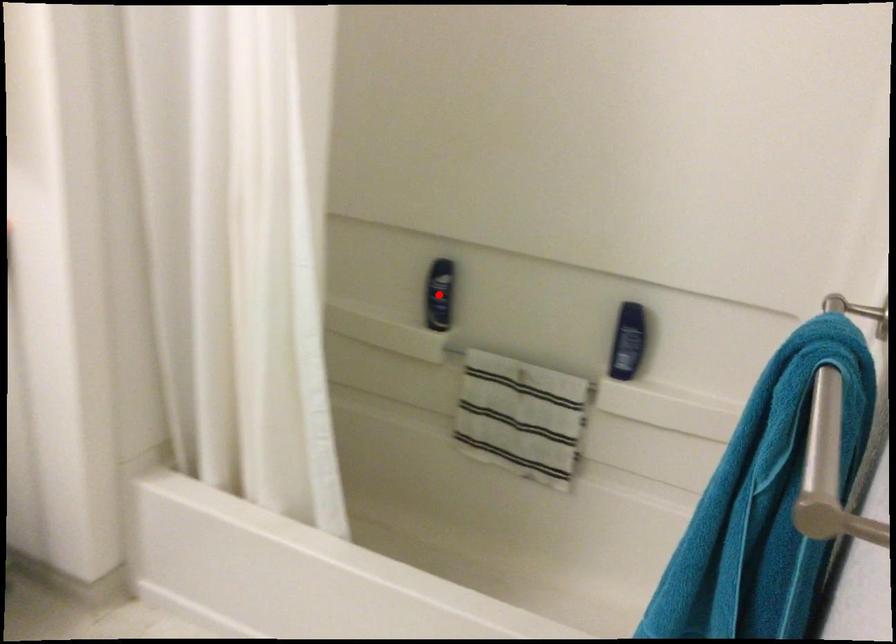
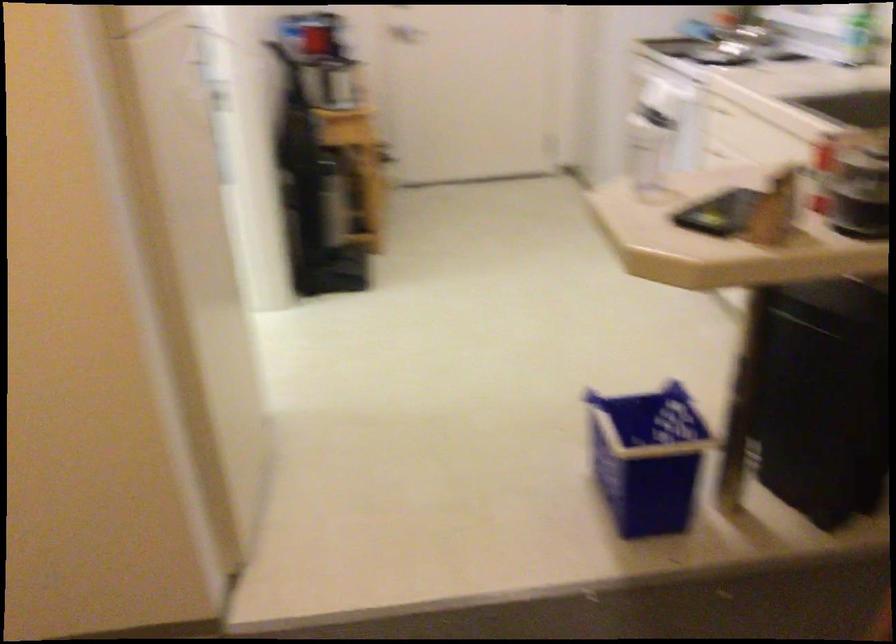
Question: I am providing you with two images of the same scene from different viewpoints. A red point is marked on the first image. Is the red point's position out of view in image 2?

Choices:
 (A) Yes
 (B) No

Answer: (A)